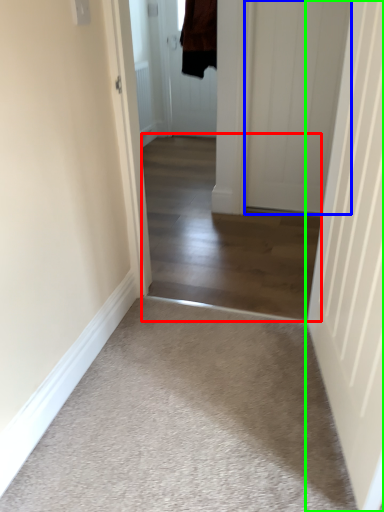
Question: Which is nearer to the corridor (highlighted by a red box)? door (highlighted by a blue box) or door (highlighted by a green box).

Choices:
 (A) door
 (B) door

Answer: (A)